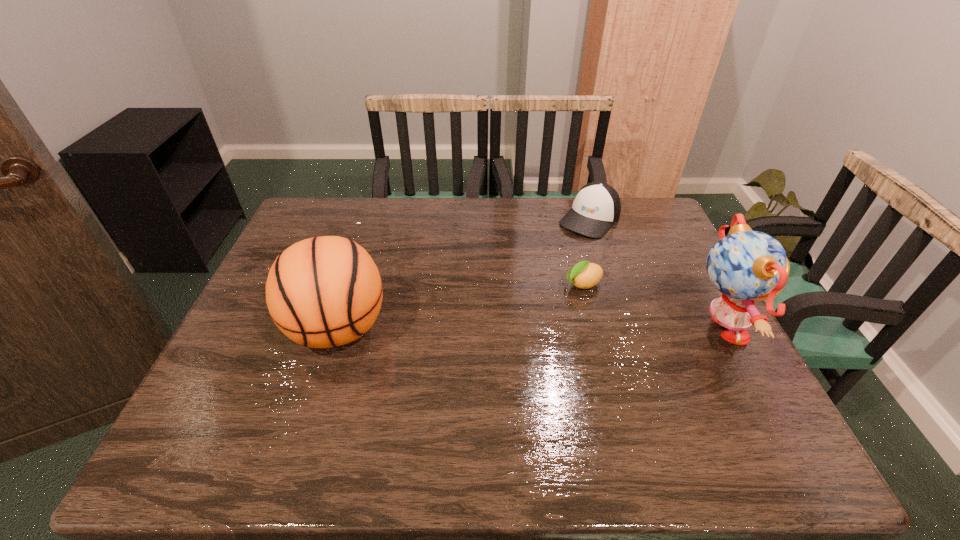
This screenshot has width=960, height=540. In order to click on the leftmost object in this screenshot , I will do `click(322, 292)`.

Locate an element on the screen. doll is located at coordinates (746, 266).

At what (x,y) coordinates should I click in order to perform the action: click on lemon. Please return your answer as a coordinate pair (x, y). Image resolution: width=960 pixels, height=540 pixels. Looking at the image, I should click on (584, 275).

Locate an element on the screen. The height and width of the screenshot is (540, 960). the farthest object is located at coordinates pos(597,206).

You are a GUI agent. You are given a task and a screenshot of the screen. Output one action in this format:
    pyautogui.click(x=<x>, y=<y>)
    Task: Click on the cap
    The width and height of the screenshot is (960, 540).
    Given the screenshot: What is the action you would take?
    pyautogui.click(x=597, y=206)

Find the location of a particular element. free spot located 0.110m on the back of the leftmost object is located at coordinates (357, 267).

This screenshot has height=540, width=960. In order to click on free space located with leaves positioned above the shortest object in this screenshot , I will do (x=533, y=305).

Identify the location of vacant point located with leaves positioned above the shortest object. The height and width of the screenshot is (540, 960). (551, 297).

Locate an element on the screen. free space located with leaves positioned above the shortest object is located at coordinates (500, 319).

Locate an element on the screen. The width and height of the screenshot is (960, 540). vacant region located on the front panel of the cap is located at coordinates (517, 299).